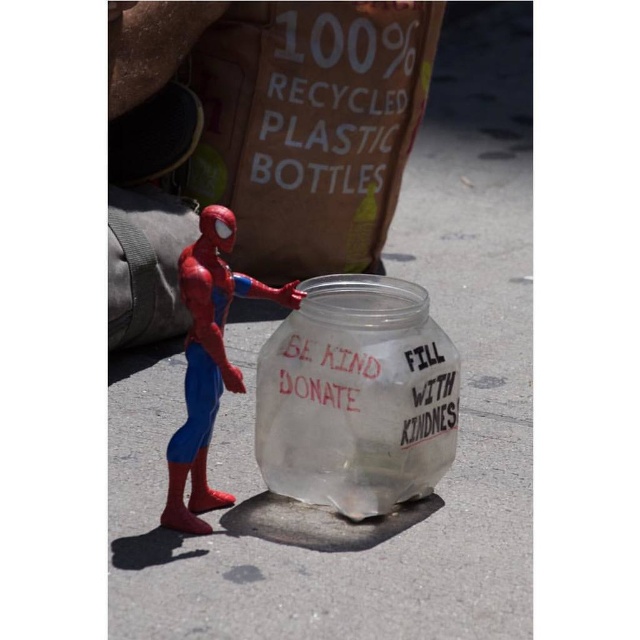
You are a photographer taking a photo of the scene. You notice two points marked in the image. The first point is at coordinate point (320,380) and the second is at point (195,273). Which point is closer to your camera?

Point (320,380) is closer to the camera because it is further to the camera than point (195,273).